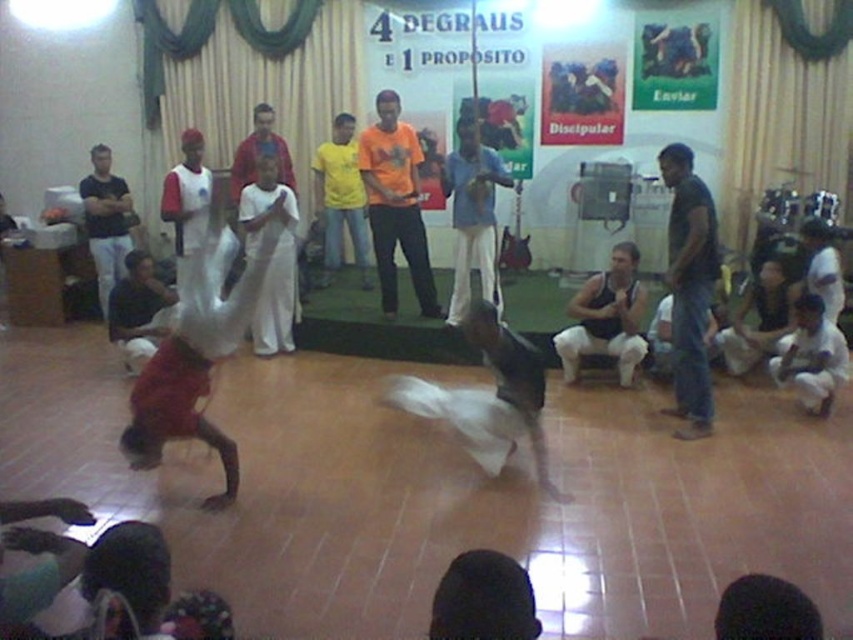
Question: Which object is farther from the camera taking this photo?

Choices:
 (A) dark gray pants at left
 (B) orange t-shirt at center

Answer: (A)

Question: Which point is closer to the camera?

Choices:
 (A) (396, 202)
 (B) (624, 301)
 (C) (689, 195)
 (D) (461, 188)

Answer: (C)

Question: Is dark blue jeans at right positioned behind light blue cotton shirt at center?

Choices:
 (A) no
 (B) yes

Answer: (A)

Question: Which of the following is the farthest from the observer?

Choices:
 (A) (701, 240)
 (B) (392, 224)
 (C) (120, 209)
 (D) (326, 225)

Answer: (D)

Question: Can you confirm if dark blue jeans at right is thinner than yellow t-shirt at center?

Choices:
 (A) no
 (B) yes

Answer: (B)

Question: Where is light blue cotton shirt at center located in relation to yellow t-shirt at center in the image?

Choices:
 (A) below
 (B) above

Answer: (A)